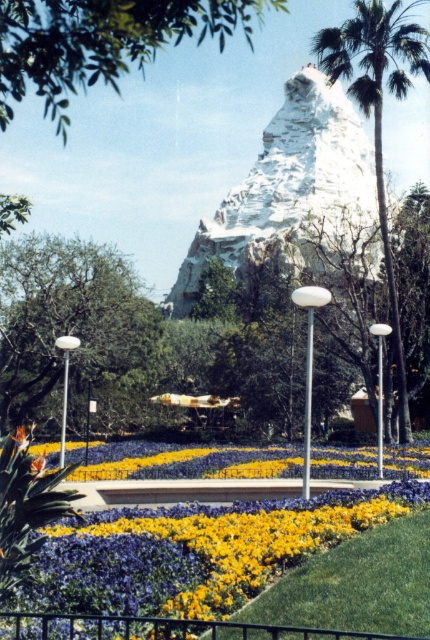
You are a GUI agent. You are given a task and a screenshot of the screen. Output one action in this format:
    pyautogui.click(x=<x>, y=<y>)
    Task: Click on the green leafy tree at lower left
    The height and width of the screenshot is (640, 430).
    Given the screenshot: What is the action you would take?
    pyautogui.click(x=70, y=323)

Does yellow matte flower bed at center have a greater width compared to green leafy tree at lower left?

Correct, the width of yellow matte flower bed at center exceeds that of green leafy tree at lower left.

Is yellow matte flower bed at center below green leafy tree at lower left?

Yes, yellow matte flower bed at center is below green leafy tree at lower left.

Who is more distant from viewer, (x=267, y=564) or (x=43, y=344)?

The point (x=43, y=344) is behind.

Locate an element on the screen. Image resolution: width=430 pixels, height=640 pixels. yellow matte flower bed at center is located at coordinates (183, 568).

Describe the element at coordinates (183, 568) in the screenshot. I see `yellow matte flower bed at center` at that location.

Who is positioned more to the right, yellow matte flower bed at center or green leafy tree at upper center?

yellow matte flower bed at center is more to the right.

Where is `yellow matte flower bed at center`? yellow matte flower bed at center is located at coordinates (183, 568).